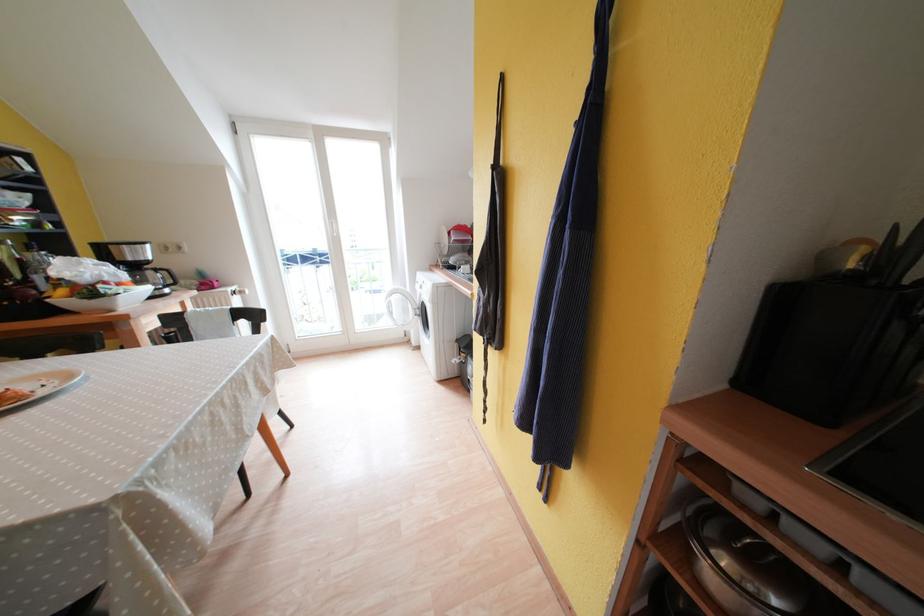
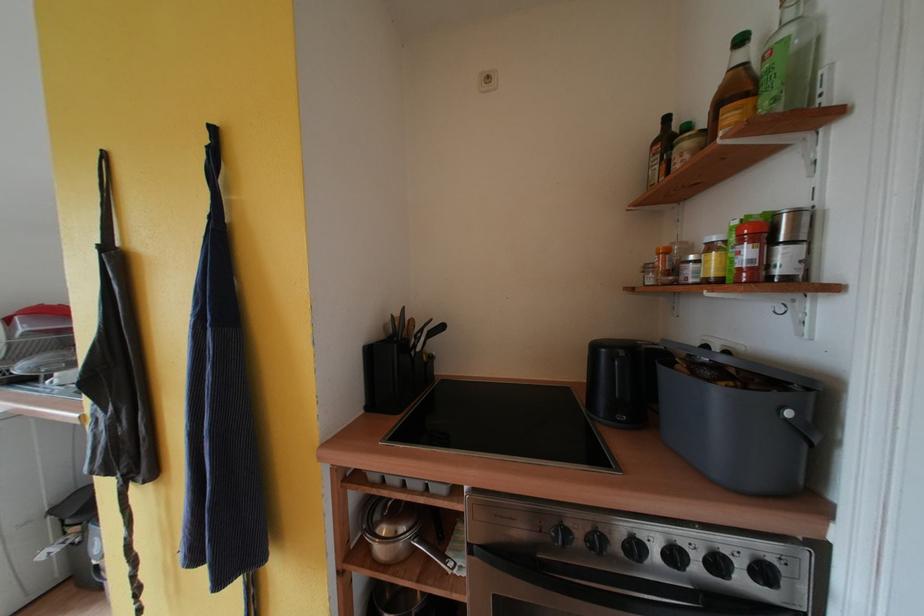
In the second image, find the point that corresponds to the point at 470,352 in the first image.

(83, 517)